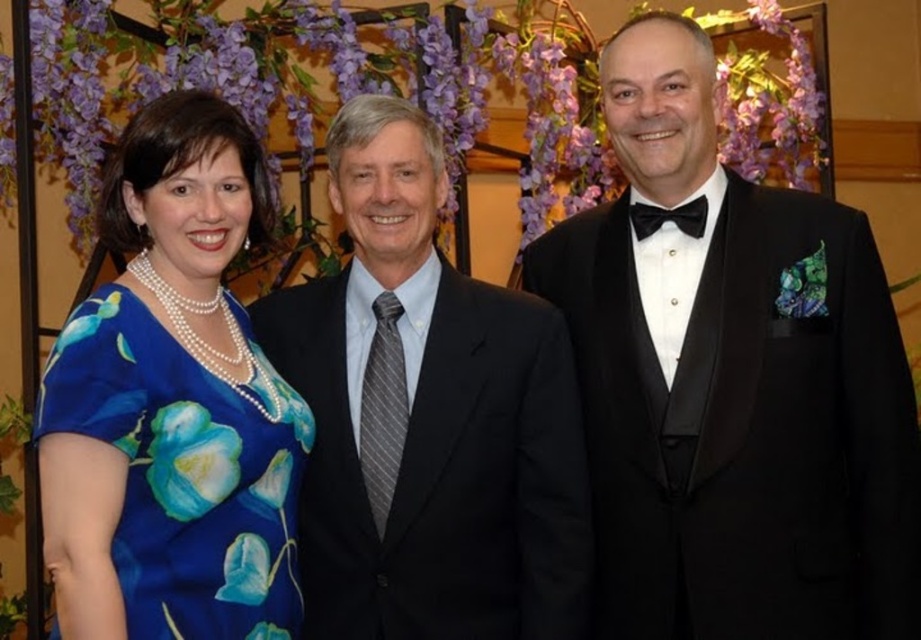
You are standing at the point with coordinates point [119,184] and want to move to the point with coordinates point [616,83]. Is the destination point in front of or behind you?

The point [616,83] is behind point [119,184], so the destination point is behind you.

You are a photographer adjusting the lighting for a group photo. The black satin tuxedo at center and the blue satin dress at left are both highly reflective. Which one requires more careful lighting adjustments to avoid glare?

The black satin tuxedo at center requires more careful lighting adjustments because it is larger and may reflect light more prominently than the blue satin dress at left.

You are standing at the point with coordinates point (388, 186) and want to walk to the point with coordinates point (686, 216). Will you have to go through any obstacles along the way?

Point (388, 186) is in front of point (686, 216), so you will have to walk behind point (388, 186) to reach point (686, 216). Therefore, there are no obstacles in between as the path is clear.